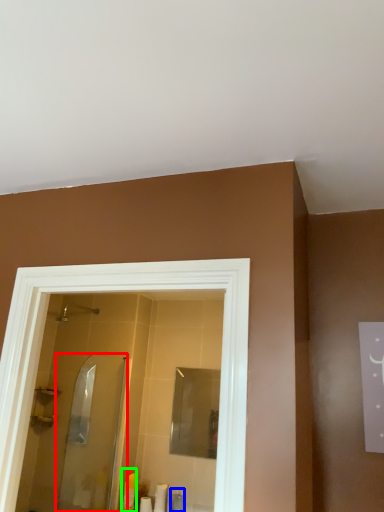
Question: Based on their relative distances, which object is nearer to screen door (highlighted by a red box)? Choose from toiletry (highlighted by a blue box) and toiletry (highlighted by a green box).

Choices:
 (A) toiletry
 (B) toiletry

Answer: (B)